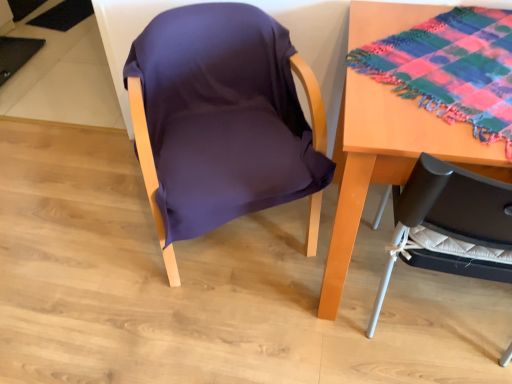
Question: Can you confirm if multicolored woven cloth at upper right is shorter than wooden table at right?

Choices:
 (A) no
 (B) yes

Answer: (B)

Question: From a real-world perspective, is multicolored woven cloth at upper right positioned over wooden table at right based on gravity?

Choices:
 (A) no
 (B) yes

Answer: (B)

Question: Would you consider multicolored woven cloth at upper right to be distant from wooden table at right?

Choices:
 (A) no
 (B) yes

Answer: (A)

Question: Can you confirm if multicolored woven cloth at upper right is smaller than wooden table at right?

Choices:
 (A) yes
 (B) no

Answer: (A)

Question: Does multicolored woven cloth at upper right have a larger size compared to wooden table at right?

Choices:
 (A) no
 (B) yes

Answer: (A)

Question: Is multicolored woven cloth at upper right next to wooden table at right?

Choices:
 (A) yes
 (B) no

Answer: (B)

Question: From a real-world perspective, is wooden table at right on purple fabric chair at center?

Choices:
 (A) no
 (B) yes

Answer: (A)

Question: Considering the relative sizes of wooden table at right and purple fabric chair at center in the image provided, is wooden table at right smaller than purple fabric chair at center?

Choices:
 (A) yes
 (B) no

Answer: (A)

Question: From a real-world perspective, is wooden table at right below purple fabric chair at center?

Choices:
 (A) yes
 (B) no

Answer: (A)

Question: Is wooden table at right at the left side of purple fabric chair at center?

Choices:
 (A) yes
 (B) no

Answer: (B)

Question: From the image's perspective, is wooden table at right under purple fabric chair at center?

Choices:
 (A) yes
 (B) no

Answer: (A)

Question: Is wooden table at right far away from purple fabric chair at center?

Choices:
 (A) yes
 (B) no

Answer: (B)

Question: From the image's perspective, is multicolored woven cloth at upper right below purple fabric chair at center?

Choices:
 (A) no
 (B) yes

Answer: (A)